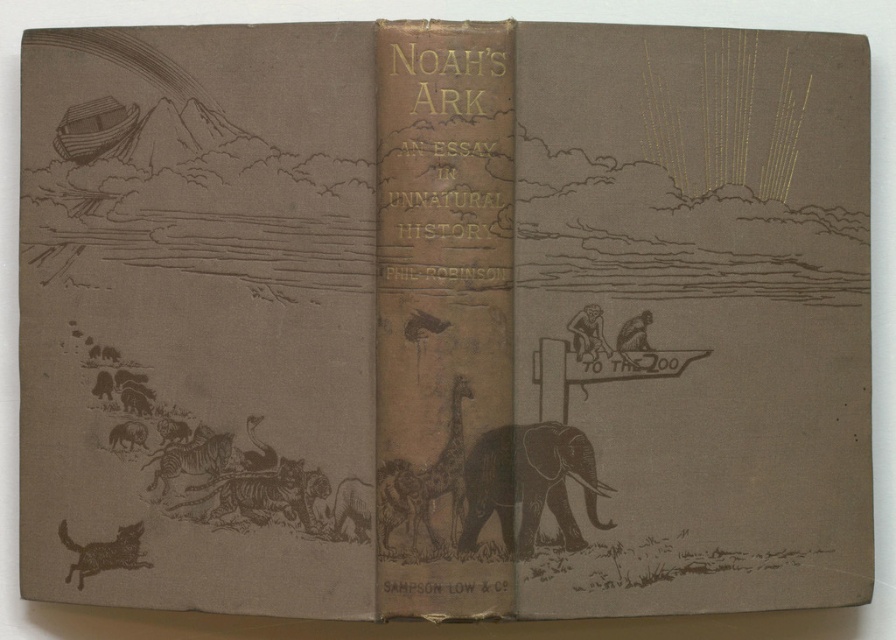
Question: Is brown textured elephant at center closer to camera compared to brown textured dog at lower left?

Choices:
 (A) no
 (B) yes

Answer: (B)

Question: Which point is closer to the camera?

Choices:
 (A) brown textured elephant at center
 (B) brown textured dog at lower left

Answer: (A)

Question: Which point is closer to the camera?

Choices:
 (A) brown textured elephant at center
 (B) brown textured dog at lower left

Answer: (A)

Question: Is brown textured elephant at center below brown textured dog at lower left?

Choices:
 (A) no
 (B) yes

Answer: (A)

Question: Where is brown textured elephant at center located in relation to brown textured dog at lower left in the image?

Choices:
 (A) below
 (B) above

Answer: (B)